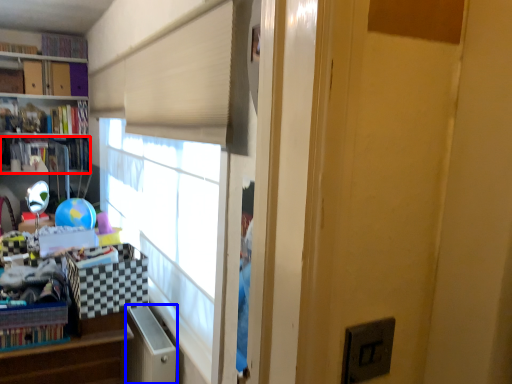
Question: Among these objects, which one is farthest to the camera, book (highlighted by a red box) or file cabinet (highlighted by a blue box)?

Choices:
 (A) book
 (B) file cabinet

Answer: (A)